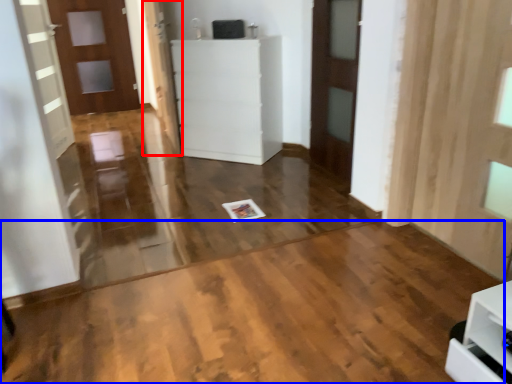
Question: Which object appears farthest to the camera in this image, door (highlighted by a red box) or plywood (highlighted by a blue box)?

Choices:
 (A) door
 (B) plywood

Answer: (A)